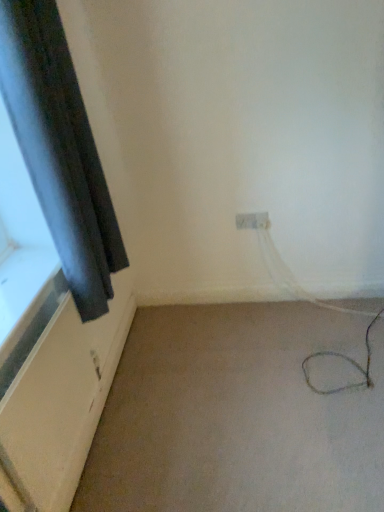
Question: Is beige carpet at lower right positioned beyond the bounds of black matte curtain at left?

Choices:
 (A) yes
 (B) no

Answer: (A)

Question: Is beige carpet at lower right oriented away from black matte curtain at left?

Choices:
 (A) yes
 (B) no

Answer: (B)

Question: Can you confirm if beige carpet at lower right is thinner than black matte curtain at left?

Choices:
 (A) no
 (B) yes

Answer: (A)

Question: Is beige carpet at lower right further to the viewer compared to black matte curtain at left?

Choices:
 (A) no
 (B) yes

Answer: (B)

Question: Would you consider beige carpet at lower right to be distant from black matte curtain at left?

Choices:
 (A) no
 (B) yes

Answer: (A)

Question: Is the position of beige carpet at lower right less distant than that of black matte curtain at left?

Choices:
 (A) yes
 (B) no

Answer: (B)

Question: Considering the relative positions of beige carpet at lower right and white plastic electric outlet at center in the image provided, is beige carpet at lower right to the right of white plastic electric outlet at center from the viewer's perspective?

Choices:
 (A) no
 (B) yes

Answer: (A)

Question: Can you confirm if beige carpet at lower right is taller than white plastic electric outlet at center?

Choices:
 (A) yes
 (B) no

Answer: (B)

Question: Is beige carpet at lower right not within white plastic electric outlet at center?

Choices:
 (A) no
 (B) yes

Answer: (B)

Question: Is beige carpet at lower right facing towards white plastic electric outlet at center?

Choices:
 (A) no
 (B) yes

Answer: (A)

Question: Are beige carpet at lower right and white plastic electric outlet at center located far from each other?

Choices:
 (A) yes
 (B) no

Answer: (B)

Question: From the image's perspective, is beige carpet at lower right above white plastic electric outlet at center?

Choices:
 (A) yes
 (B) no

Answer: (B)

Question: Can you confirm if black matte curtain at left is bigger than white plastic electric outlet at center?

Choices:
 (A) no
 (B) yes

Answer: (B)